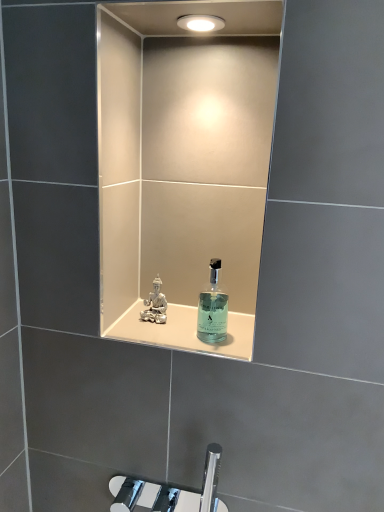
This screenshot has height=512, width=384. Find the location of `free space to the left of transparent glass bottle at center`. free space to the left of transparent glass bottle at center is located at coordinates (155, 335).